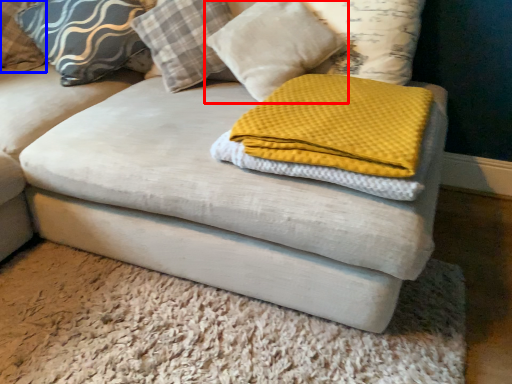
Question: Which point is closer to the camera, pillow (highlighted by a red box) or pillow (highlighted by a blue box)?

Choices:
 (A) pillow
 (B) pillow

Answer: (A)